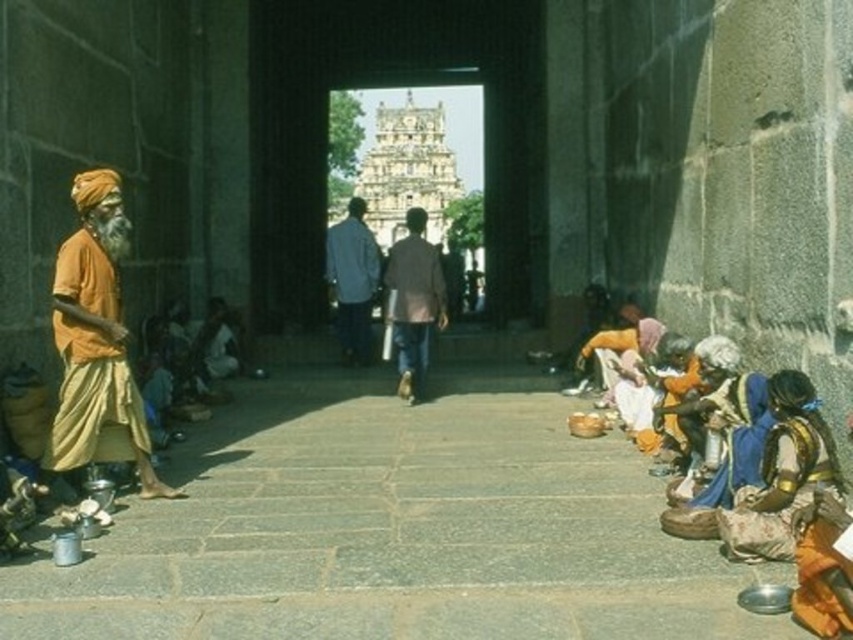
In the scene shown: You are a visitor at the temple entrance and want to take a photo of both the orange cotton turban at left and the brown fabric jacket at center. Which object should you frame first in your camera viewfinder to ensure both are captured in the same shot?

You should frame the orange cotton turban at left first since it is positioned to the left of the brown fabric jacket at center, ensuring both are included in the same shot.

You are a tour guide leading a group through the temple entrance. You notice two visitors wearing a brown fabric jacket at center and a light blue shirt at center. Your group needs to move from the entrance to the main hall, which is 10 meters away. Can both visitors stay within your group while maintaining a safe distance of 2 meters between each other and the group members?

The distance between the brown fabric jacket at center and the light blue shirt at center is 7.43 meters. Since the group needs to maintain a safe distance of 2 meters between each other and the visitors, the total required space would be 7.43 meters plus 2 meters, totaling 9.43 meters. The main hall is 10 meters away, so there is enough space for both visitors to stay within the group while maintaining the required distance.

You are a tourist standing at the entrance of the temple and want to take a photo of the orange cotton turban at left and the light blue shirt at center. If your camera has a maximum focus range of 30 meters, will you be able to capture both subjects in focus without moving closer?

The distance between the orange cotton turban at left and the light blue shirt at center is 35.18 meters, which exceeds the camera maximum focus range of 30 meters. Therefore, you cannot capture both subjects in focus without moving closer.